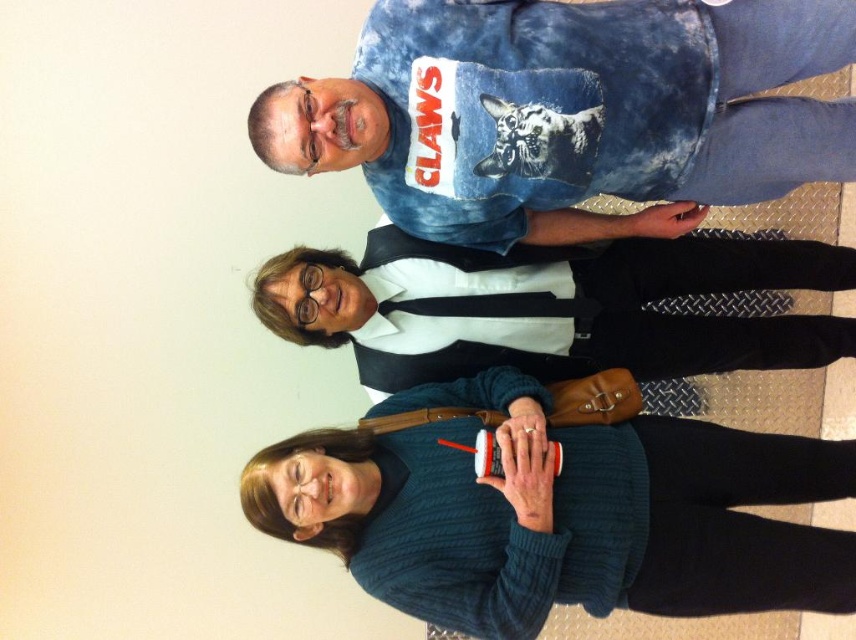
Does tie-dye cotton shirt at upper center have a lesser height compared to dark blue knitted sweater at center?

Indeed, tie-dye cotton shirt at upper center has a lesser height compared to dark blue knitted sweater at center.

Is tie-dye cotton shirt at upper center to the left of dark blue knitted sweater at center from the viewer's perspective?

Yes, tie-dye cotton shirt at upper center is to the left of dark blue knitted sweater at center.

Identify the location of tie-dye cotton shirt at upper center. This screenshot has width=856, height=640. (569, 112).

Between dark blue knitted sweater at center and denim shirt at center, which one appears on the left side from the viewer's perspective?

dark blue knitted sweater at center is more to the left.

Is the position of dark blue knitted sweater at center less distant than that of denim shirt at center?

That is True.

Does point (714, 476) come in front of point (483, 292)?

That is True.

Find the location of a particular element. dark blue knitted sweater at center is located at coordinates (560, 513).

How far apart are tie-dye cotton shirt at upper center and denim shirt at center?

tie-dye cotton shirt at upper center and denim shirt at center are 13.26 inches apart from each other.

What do you see at coordinates (569, 112) in the screenshot? I see `tie-dye cotton shirt at upper center` at bounding box center [569, 112].

Where is `tie-dye cotton shirt at upper center`? tie-dye cotton shirt at upper center is located at coordinates (569, 112).

This screenshot has height=640, width=856. I want to click on tie-dye cotton shirt at upper center, so click(569, 112).